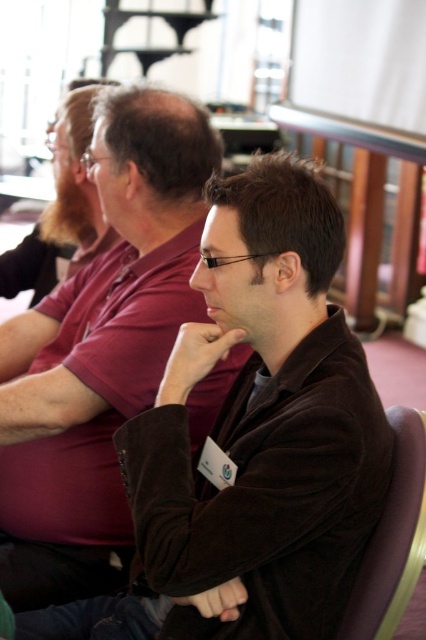
You are a photographer in a conference room. You want to take a photo of the brown velvety shirt at center and the purple fabric chair at lower right. The camera you have can only focus on objects within 25 inches of each other. Can you capture both in focus?

The brown velvety shirt at center is 26.21 inches away from the purple fabric chair at lower right. Since the distance exceeds the camera focus range of 25 inches, the camera cannot focus on both objects simultaneously.